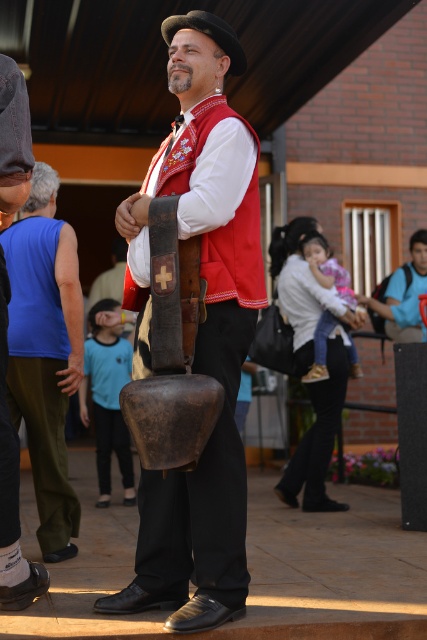
Based on the photo, you are attending a cultural festival and notice a performer wearing a blue sleeveless shirt at left and holding a wooden bell at center. Which item is taller when viewed from your perspective?

The wooden bell at center is taller than the blue sleeveless shirt at left.

You are standing at the point with coordinates point [56,358] and want to move to the point with coordinates point [257,296]. Which direction should you move in to reach your destination?

To move from point [56,358] to point [257,296], you should move upwards and to the left since point [257,296] is in front of point [56,358].